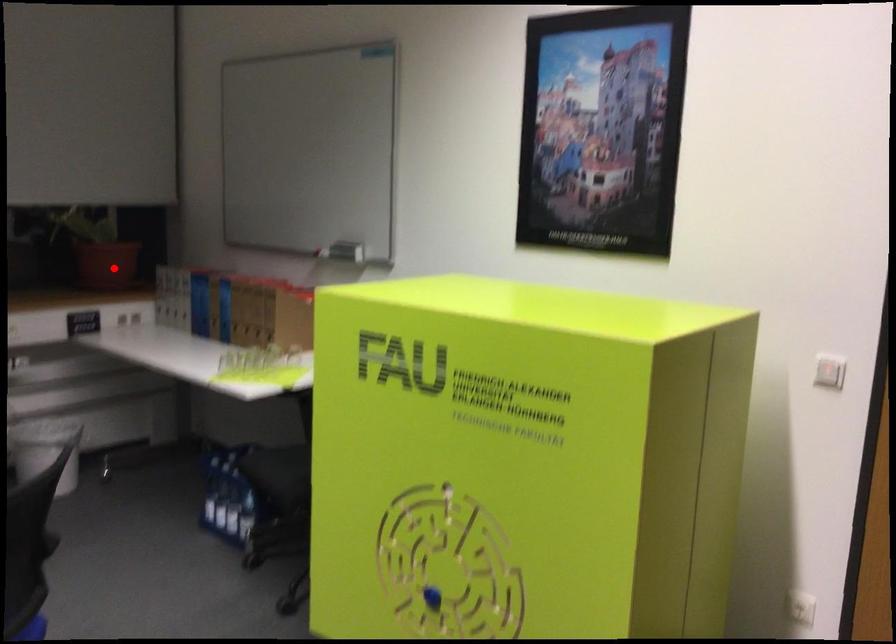
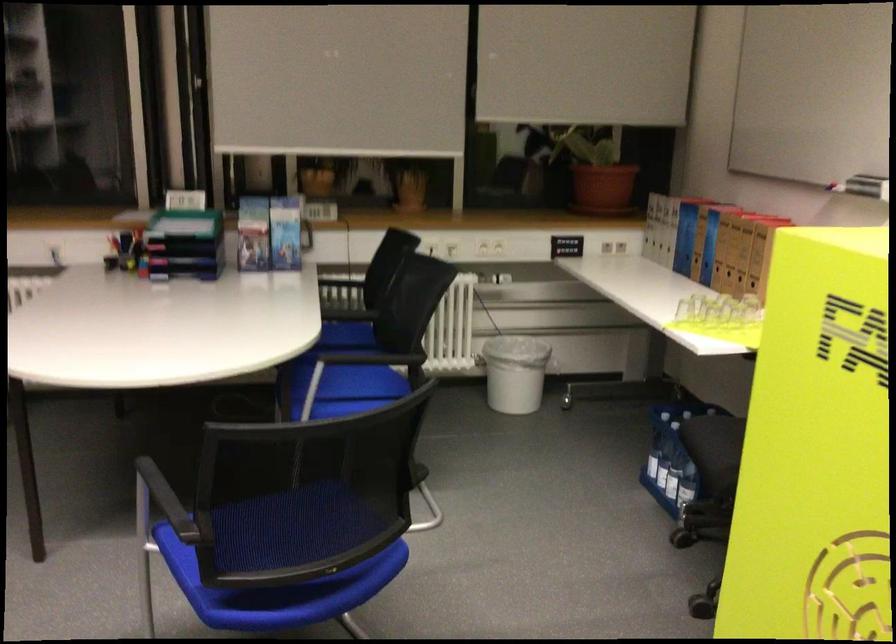
Locate, in the second image, the point that corresponds to the highlighted location in the first image.

(602, 187)